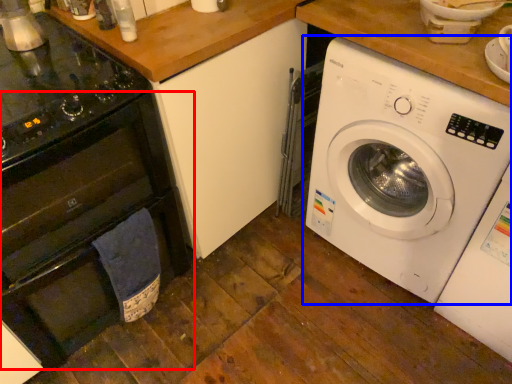
Question: Which object appears farthest to the camera in this image, oven (highlighted by a red box) or washing machine (highlighted by a blue box)?

Choices:
 (A) oven
 (B) washing machine

Answer: (B)